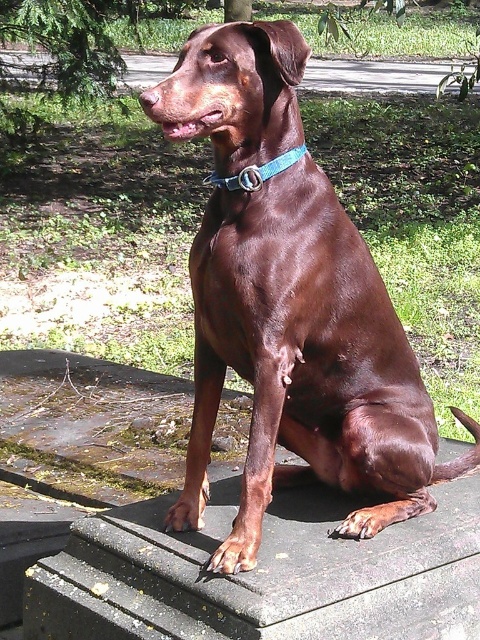
Question: Is shiny brown dog at center to the left of teal fabric collar at center from the viewer's perspective?

Choices:
 (A) yes
 (B) no

Answer: (B)

Question: Can you confirm if smooth concrete ledge at center is wider than teal fabric collar at center?

Choices:
 (A) no
 (B) yes

Answer: (B)

Question: Is shiny brown dog at center closer to the viewer compared to smooth concrete ledge at center?

Choices:
 (A) yes
 (B) no

Answer: (A)

Question: Based on their relative distances, which object is farther from the shiny brown dog at center?

Choices:
 (A) smooth concrete ledge at center
 (B) teal fabric collar at center

Answer: (B)

Question: Which point appears farthest from the camera in this image?

Choices:
 (A) (218, 241)
 (B) (244, 186)

Answer: (A)

Question: Which object is the closest to the teal fabric collar at center?

Choices:
 (A) shiny brown dog at center
 (B) smooth concrete ledge at center

Answer: (A)